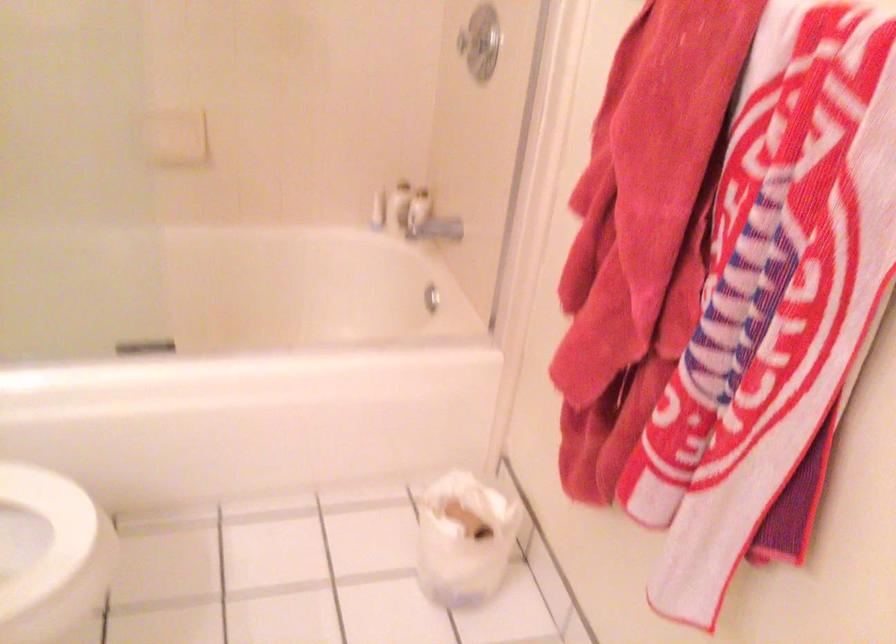
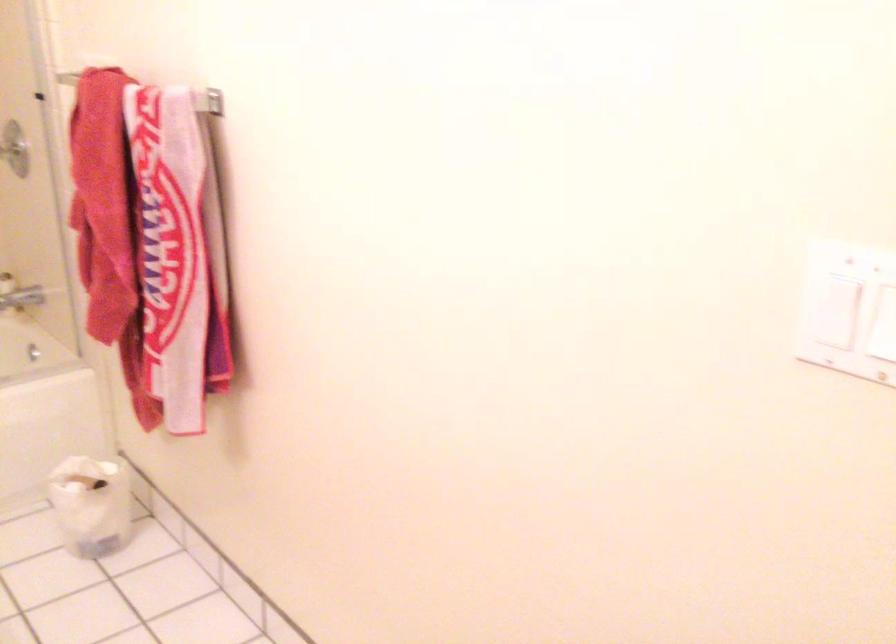
The point at (459, 558) is marked in the first image. Where is the corresponding point in the second image?

(90, 505)